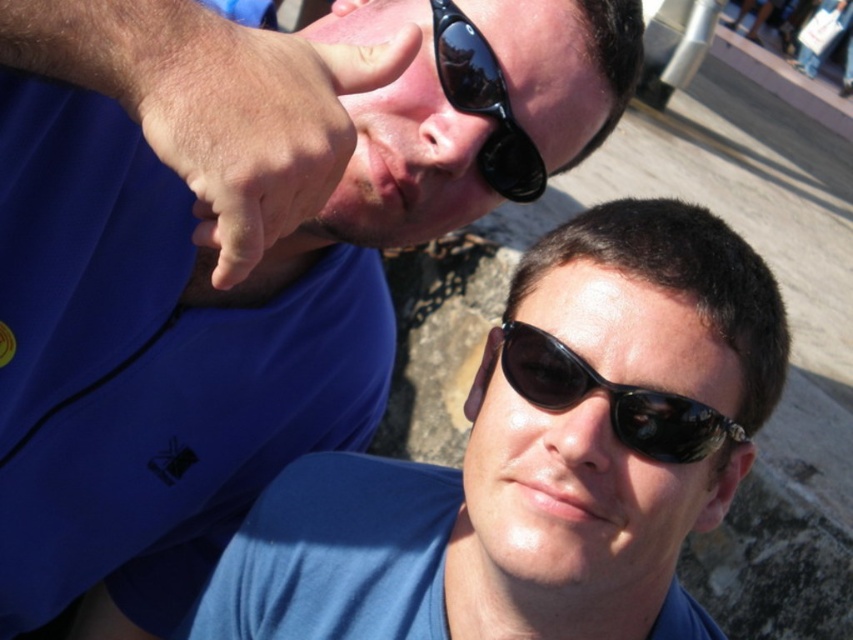
Can you confirm if dry skin at upper center is smaller than black reflective sunglasses at center?

Yes, dry skin at upper center is smaller than black reflective sunglasses at center.

Which is more to the right, dry skin at upper center or black reflective sunglasses at center?

black reflective sunglasses at center

Find the location of `dry skin at upper center`. dry skin at upper center is located at coordinates (247, 120).

The image size is (853, 640). I want to click on dry skin at upper center, so click(x=247, y=120).

Does dry skin at upper center appear over matte black nose at upper center?

Actually, dry skin at upper center is below matte black nose at upper center.

Locate an element on the screen. This screenshot has height=640, width=853. dry skin at upper center is located at coordinates (247, 120).

The image size is (853, 640). In order to click on dry skin at upper center in this screenshot , I will do `click(247, 120)`.

Which is more to the left, matte blue shirt at center or matte black nose at center?

Positioned to the left is matte blue shirt at center.

Is matte blue shirt at center wider than matte black nose at center?

Correct, the width of matte blue shirt at center exceeds that of matte black nose at center.

Image resolution: width=853 pixels, height=640 pixels. What are the coordinates of `matte blue shirt at center` in the screenshot? It's located at (538, 460).